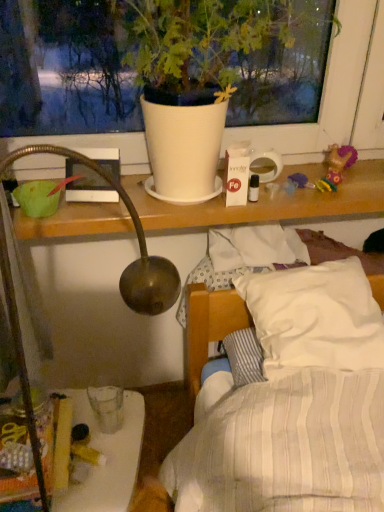
Identify the location of vacant region above translucent plastic glass at lower left (from a real-world perspective). (99, 440).